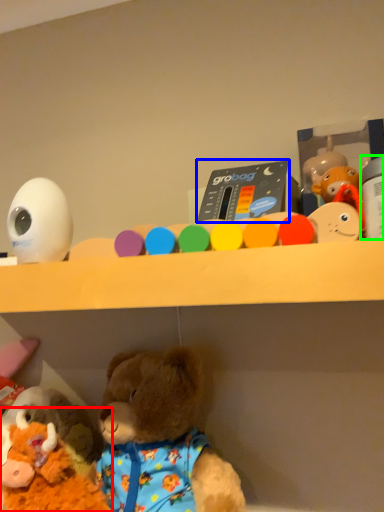
Question: Considering the real-world distances, which object is closest to toy (highlighted by a red box)? toy (highlighted by a blue box) or toy (highlighted by a green box).

Choices:
 (A) toy
 (B) toy

Answer: (A)